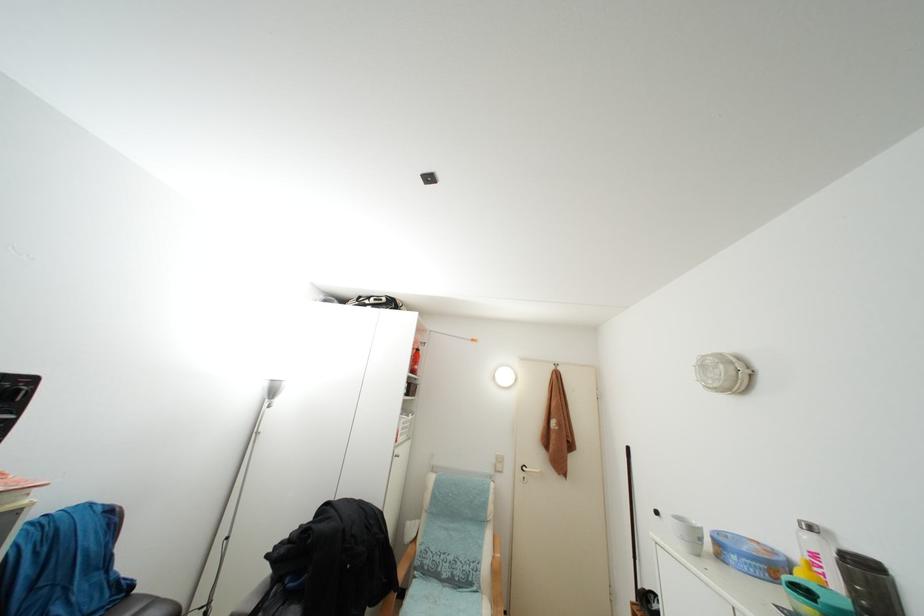
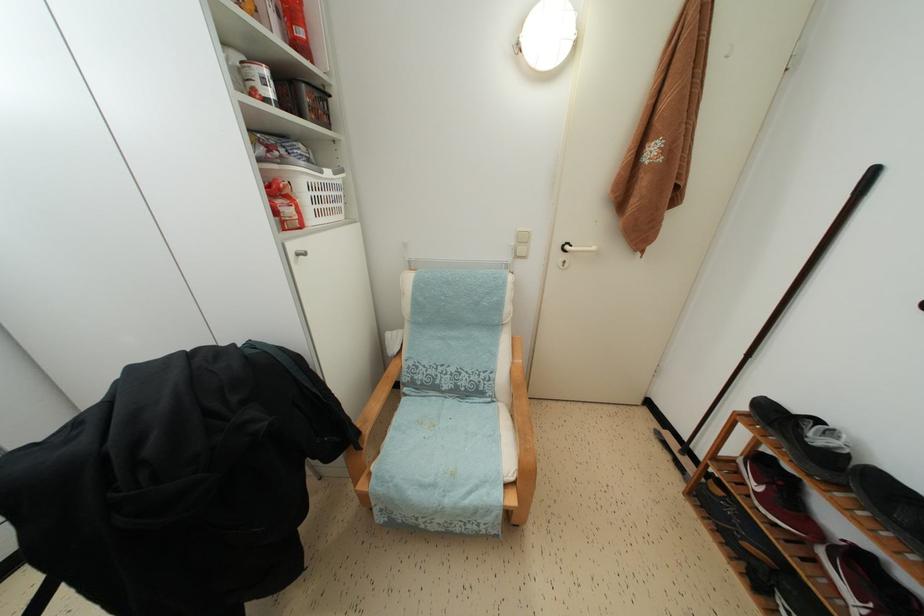
Find the pixel in the second image that matches pixel 555 451 in the first image.

(638, 207)